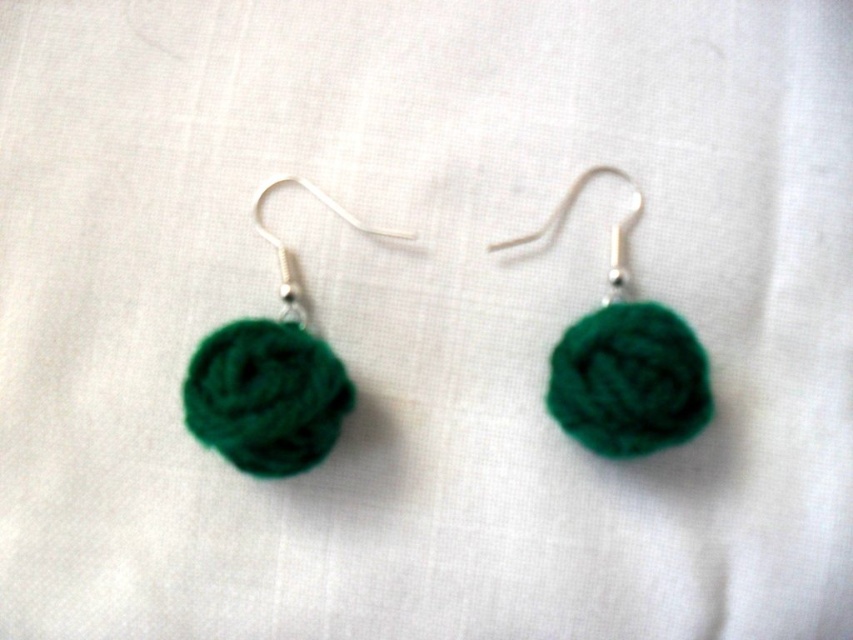
Consider the image. Does emerald green felt ball at left appear over green fuzzy ball at center?

No.

Can you confirm if emerald green felt ball at left is taller than green fuzzy ball at center?

Yes.

Is point (338, 432) positioned before point (613, 401)?

No, it is not.

The width and height of the screenshot is (853, 640). I want to click on emerald green felt ball at left, so click(x=271, y=374).